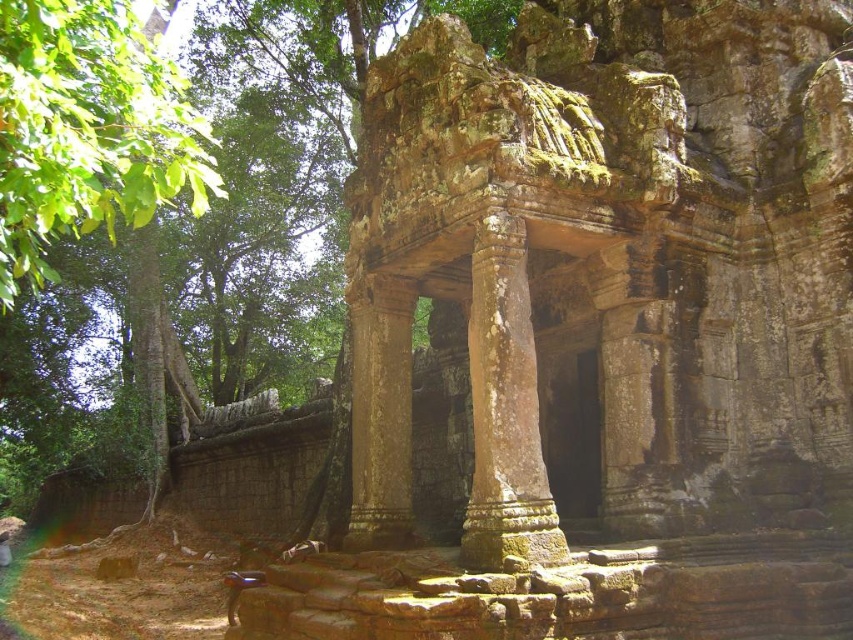
Question: Which is farther from the rusty stone pillar at center?

Choices:
 (A) green leafy tree at left
 (B) brown stone temple at center

Answer: (A)

Question: Which of these objects is positioned farthest from the green leafy tree at left?

Choices:
 (A) brown stone temple at center
 (B) rusty stone pillar at center

Answer: (A)

Question: Is brown stone temple at center thinner than rusty stone pillar at center?

Choices:
 (A) yes
 (B) no

Answer: (B)

Question: Can you confirm if green leafy tree at left is bigger than rusty stone pillar at center?

Choices:
 (A) no
 (B) yes

Answer: (B)

Question: Is brown stone temple at center below green leafy tree at left?

Choices:
 (A) no
 (B) yes

Answer: (B)

Question: Which point is farther from the camera taking this photo?

Choices:
 (A) (51, 230)
 (B) (682, 333)

Answer: (B)